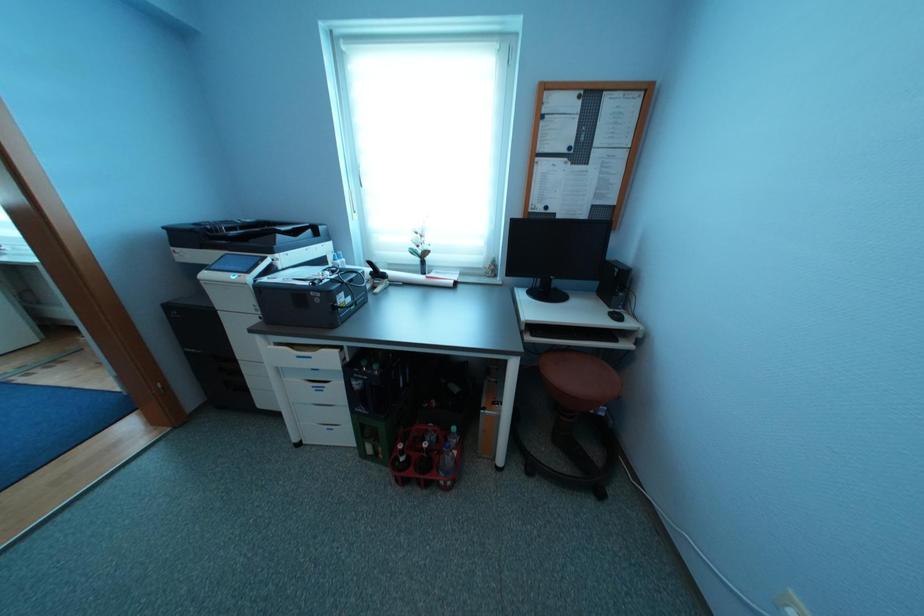
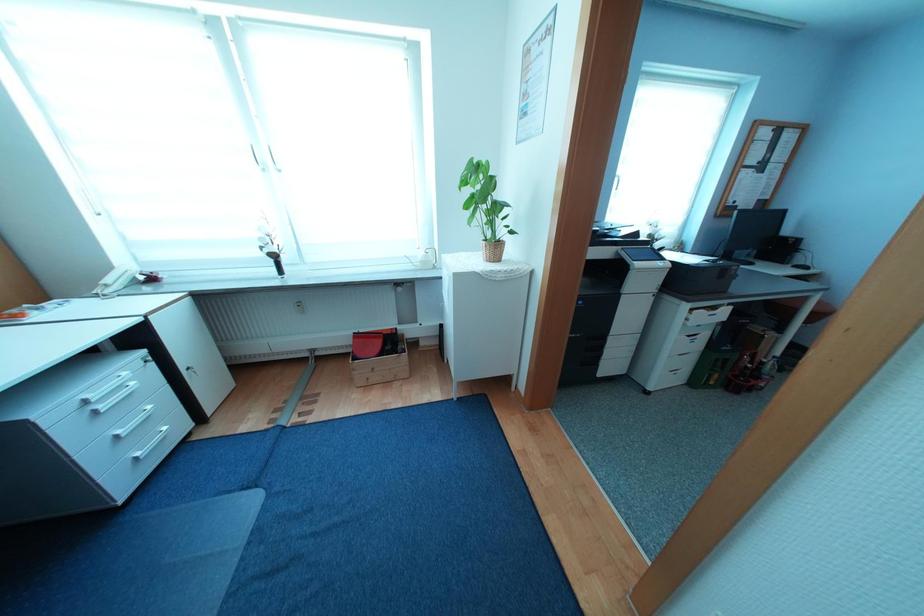
Question: Which direction would the cameraman need to move to produce the second image? Reply with the corresponding letter.

Choices:
 (A) Left
 (B) Right
 (C) Forward
 (D) Backward

Answer: (A)